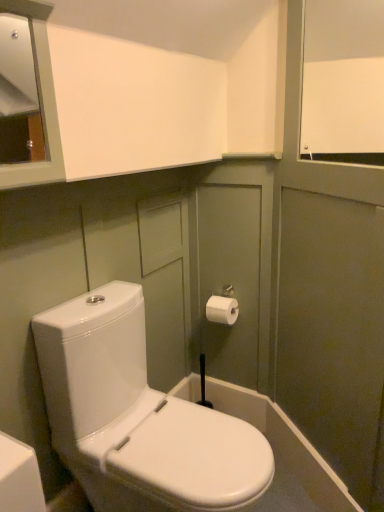
Question: Is white matte window screen at upper right oriented away from white glossy toilet at center?

Choices:
 (A) no
 (B) yes

Answer: (A)

Question: From a real-world perspective, is white matte window screen at upper right positioned over white glossy toilet at center based on gravity?

Choices:
 (A) no
 (B) yes

Answer: (B)

Question: Can you confirm if white matte window screen at upper right is thinner than white glossy toilet at center?

Choices:
 (A) yes
 (B) no

Answer: (A)

Question: Considering the relative positions of white matte window screen at upper right and white glossy toilet at center in the image provided, is white matte window screen at upper right to the left of white glossy toilet at center from the viewer's perspective?

Choices:
 (A) no
 (B) yes

Answer: (A)

Question: Is white matte window screen at upper right smaller than white glossy toilet at center?

Choices:
 (A) no
 (B) yes

Answer: (B)

Question: From their relative heights in the image, would you say white glossy toilet at center is taller or shorter than white matte window screen at upper right?

Choices:
 (A) tall
 (B) short

Answer: (A)

Question: Would you say white glossy toilet at center is to the left or to the right of white matte window screen at upper right in the picture?

Choices:
 (A) left
 (B) right

Answer: (A)

Question: In the image, is white glossy toilet at center positioned in front of or behind white matte window screen at upper right?

Choices:
 (A) front
 (B) behind

Answer: (A)

Question: From a real-world perspective, relative to white matte window screen at upper right, is white glossy toilet at center vertically above or below?

Choices:
 (A) below
 (B) above

Answer: (A)

Question: Is white paper toilet paper at upper right in front of or behind white glossy toilet at center in the image?

Choices:
 (A) behind
 (B) front

Answer: (A)

Question: From a real-world perspective, relative to white glossy toilet at center, is white paper toilet paper at upper right vertically above or below?

Choices:
 (A) above
 (B) below

Answer: (A)

Question: Is white paper toilet paper at upper right taller or shorter than white glossy toilet at center?

Choices:
 (A) short
 (B) tall

Answer: (A)

Question: From the image's perspective, relative to white glossy toilet at center, is white paper toilet paper at upper right above or below?

Choices:
 (A) below
 (B) above

Answer: (B)

Question: From a real-world perspective, is white glossy toilet at center physically located above or below white paper toilet paper at upper right?

Choices:
 (A) below
 (B) above

Answer: (A)

Question: From their relative heights in the image, would you say white glossy toilet at center is taller or shorter than white paper toilet paper at upper right?

Choices:
 (A) tall
 (B) short

Answer: (A)